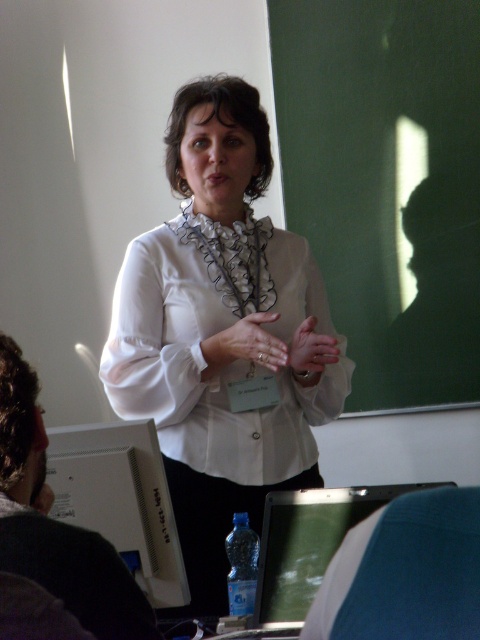
Measure the distance from green chalkboard at upper right to blue plastic bottle at center.

A distance of 4.28 feet exists between green chalkboard at upper right and blue plastic bottle at center.

Image resolution: width=480 pixels, height=640 pixels. In order to click on green chalkboard at upper right in this screenshot , I will do `click(386, 182)`.

I want to click on green chalkboard at upper right, so click(x=386, y=182).

Is white satin blouse at center wider than green chalkboard at upper right?

In fact, white satin blouse at center might be narrower than green chalkboard at upper right.

Between point (260, 380) and point (452, 381), which one is positioned behind?

The point (452, 381) is more distant.

Image resolution: width=480 pixels, height=640 pixels. What are the coordinates of `white satin blouse at center` in the screenshot? It's located at (223, 333).

You are a GUI agent. You are given a task and a screenshot of the screen. Output one action in this format:
    pyautogui.click(x=<x>, y=<y>)
    Task: Click on the white satin blouse at center
    Image resolution: width=480 pixels, height=640 pixels.
    Given the screenshot: What is the action you would take?
    coord(223,333)

Does white satin blouse at center have a greater height compared to blue plastic bottle at center?

Yes, white satin blouse at center is taller than blue plastic bottle at center.

Between white satin blouse at center and blue plastic bottle at center, which one is positioned lower?

Positioned lower is blue plastic bottle at center.

Which is in front, point (124, 388) or point (252, 604)?

Point (252, 604) is in front.

The image size is (480, 640). Find the location of `white satin blouse at center`. white satin blouse at center is located at coordinates (223, 333).